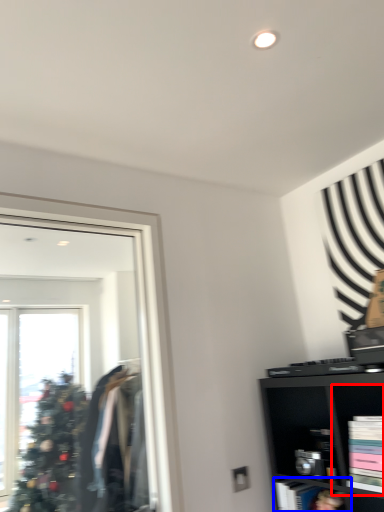
Question: Which point is further to the camera, cabinet (highlighted by a red box) or cabinet (highlighted by a blue box)?

Choices:
 (A) cabinet
 (B) cabinet

Answer: (B)